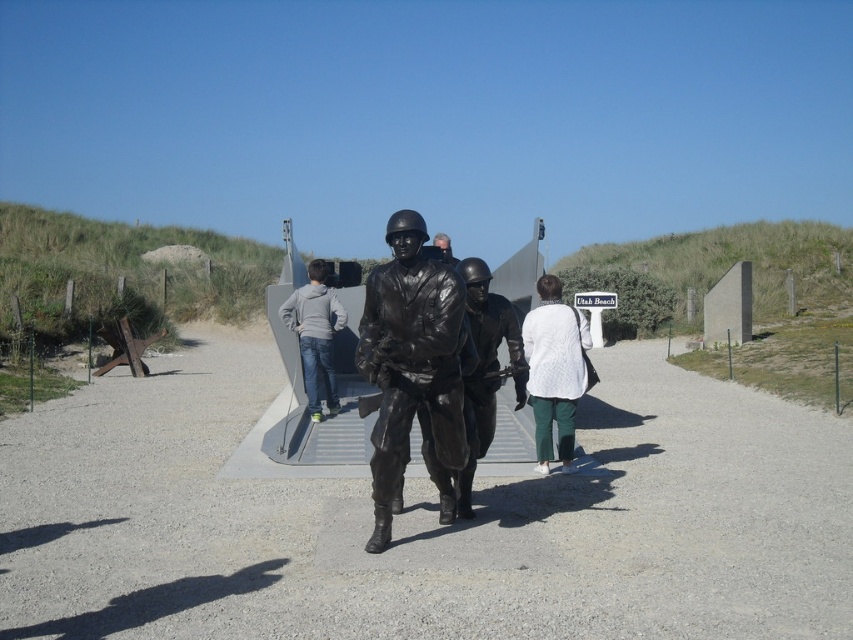
Question: Which point is closer to the camera taking this photo?

Choices:
 (A) (434, 243)
 (B) (576, 314)
 (C) (438, 323)

Answer: (C)

Question: Which of the following is the farthest from the observer?

Choices:
 (A) bronze statue at center
 (B) matte black helmet at center
 (C) gray matte hoodie at center

Answer: (C)

Question: Is shiny black helmet at center above gray matte hoodie at center?

Choices:
 (A) no
 (B) yes

Answer: (A)

Question: Can you confirm if white fuzzy sweater at center is thinner than matte black helmet at center?

Choices:
 (A) no
 (B) yes

Answer: (B)

Question: Does bronze statue at center have a smaller size compared to matte black helmet at center?

Choices:
 (A) no
 (B) yes

Answer: (B)

Question: Which of the following is the farthest from the observer?

Choices:
 (A) matte black helmet at center
 (B) shiny black helmet at center
 (C) bronze statue at center
 (D) gray matte hoodie at center

Answer: (D)